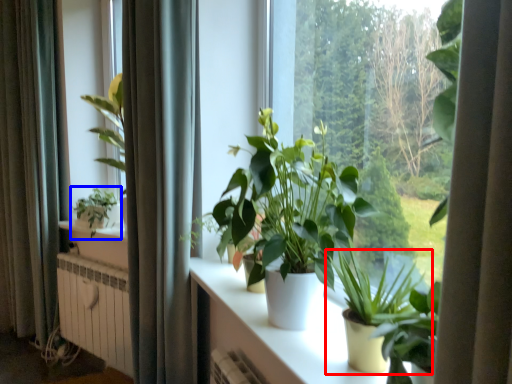
Question: Which object is closer to the camera taking this photo, houseplant (highlighted by a red box) or houseplant (highlighted by a blue box)?

Choices:
 (A) houseplant
 (B) houseplant

Answer: (A)